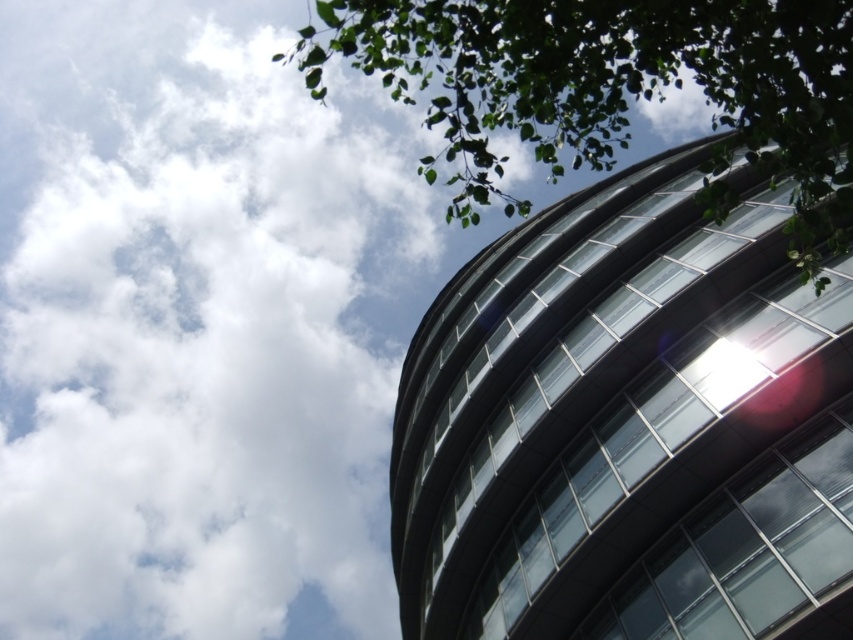
Looking at this image, you are standing at the center of the image and want to locate the transparent glass building at upper right. According to the coordinate system where the bottom left corner is the origin, what are its coordinates?

The transparent glass building at upper right is located at coordinates approximately 0.662 in the x direction and 0.736 in the y direction.

You are an architect reviewing this building design. You notice the white fluffy cloud at upper left and the green leafy tree at upper right in the background. Which of these two objects appears larger in the image?

The white fluffy cloud at upper left appears much larger than the green leafy tree at upper right in the image.